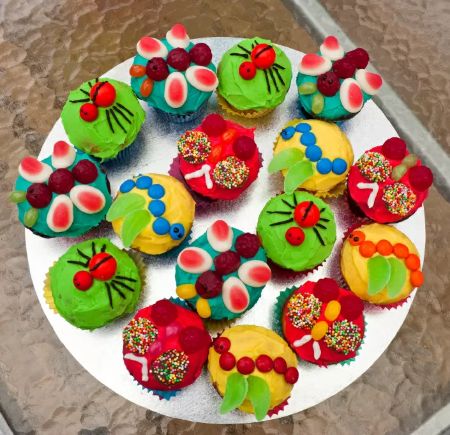
You are a GUI agent. You are given a task and a screenshot of the screen. Output one action in this format:
    pyautogui.click(x=<x>, y=<y>)
    Task: Click on the glass table
    
    Given the screenshot: What is the action you would take?
    pyautogui.click(x=51, y=36), pyautogui.click(x=400, y=50), pyautogui.click(x=406, y=348), pyautogui.click(x=43, y=376)